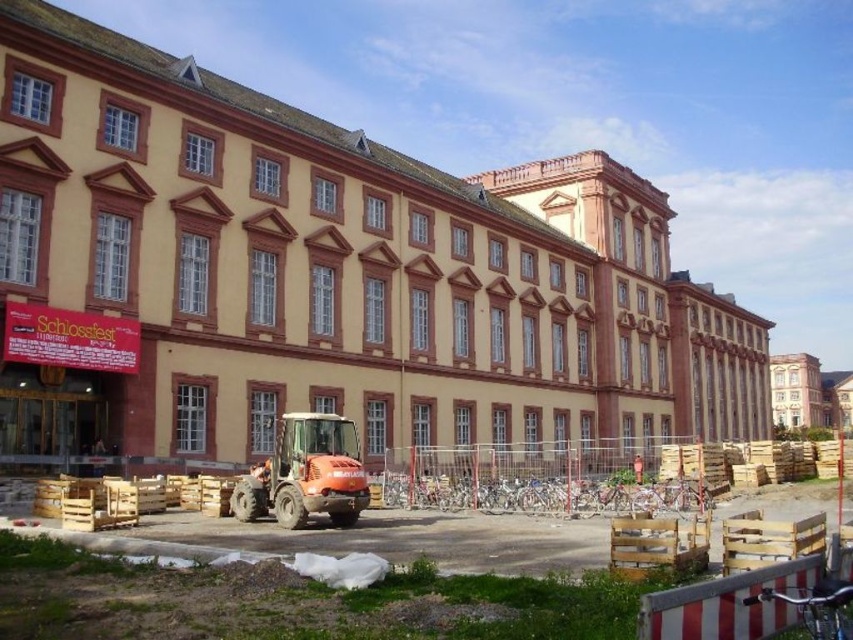
From the picture: You are standing in front of the beige stone building at center and the orange compact tractor at center. Which object is closer to you?

The orange compact tractor at center is closer to you because the beige stone building at center is further away.

You are a construction worker standing at the entrance of the beige stone building at center. You need to lift materials to the second floor. Can the orange compact tractor at center reach the height required to do this?

The beige stone building at center is taller than the orange compact tractor at center. Since the tractor cannot reach the second floor height, it cannot be used to lift materials there.